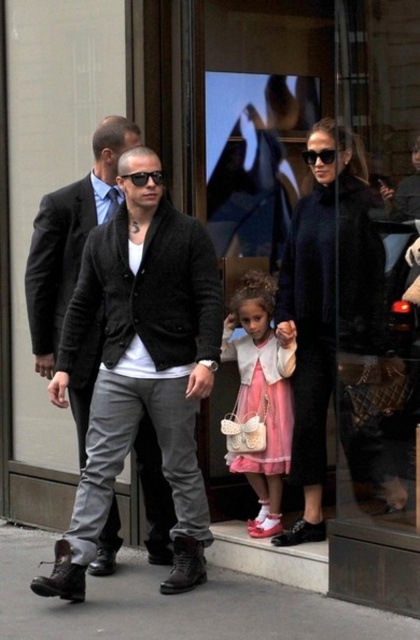
Question: Which object appears farthest from the camera in this image?

Choices:
 (A) concrete pavement at lower center
 (B) pink satin dress at center

Answer: (B)

Question: Is dark gray knit cardigan at center to the left of pink satin dress at center from the viewer's perspective?

Choices:
 (A) no
 (B) yes

Answer: (B)

Question: Is pink satin dress at center closer to the viewer compared to black plastic sunglasses at upper center?

Choices:
 (A) no
 (B) yes

Answer: (A)

Question: Is concrete pavement at lower center below pink satin dress at center?

Choices:
 (A) no
 (B) yes

Answer: (B)

Question: Among these points, which one is nearest to the camera?

Choices:
 (A) (328, 160)
 (B) (291, 605)
 (C) (183, 339)
 (D) (162, 177)

Answer: (B)

Question: Among these points, which one is farthest from the camera?

Choices:
 (A) (244, 376)
 (B) (223, 579)
 (C) (144, 173)

Answer: (A)